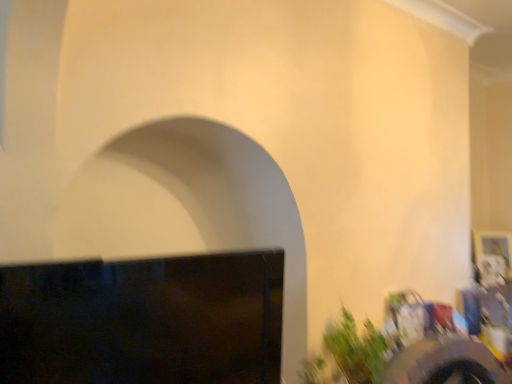
Question: Should I look upward or downward to see green leafy plant at lower right?

Choices:
 (A) up
 (B) down

Answer: (B)